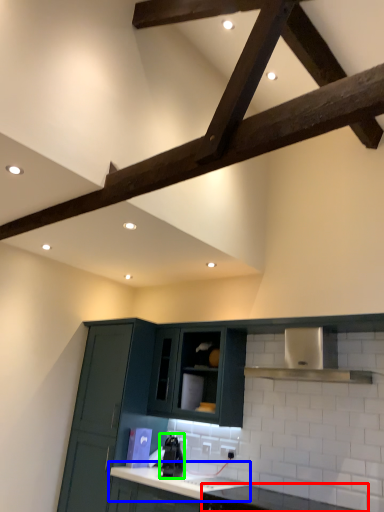
Question: Which object is the farthest from countertop (highlighted by a red box)? Choose among these: countertop (highlighted by a blue box) or appliance (highlighted by a green box).

Choices:
 (A) countertop
 (B) appliance

Answer: (B)